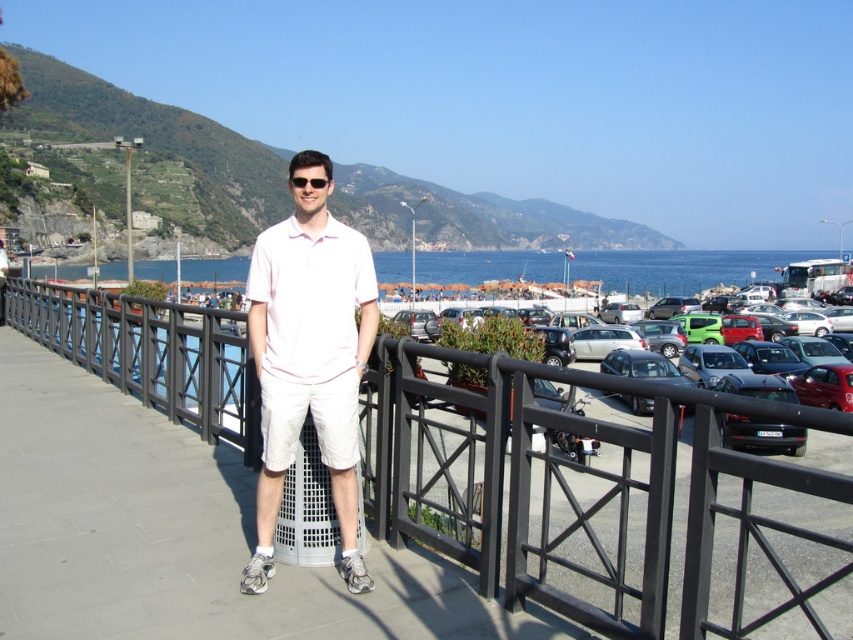
Question: Is black metal fence at center wider than shiny black car at center?

Choices:
 (A) yes
 (B) no

Answer: (A)

Question: Is black metal fence at center bigger than pink cotton polo shirt at center?

Choices:
 (A) yes
 (B) no

Answer: (A)

Question: Considering the real-world distances, which object is closest to the white cotton shirt at center?

Choices:
 (A) blue water at center
 (B) pink cotton polo shirt at center

Answer: (B)

Question: Which of the following is the farthest from the observer?

Choices:
 (A) pink cotton polo shirt at center
 (B) black metal fence at center

Answer: (A)

Question: From the image, what is the correct spatial relationship of white cotton shirt at center in relation to blue water at center?

Choices:
 (A) right
 (B) left

Answer: (B)

Question: Estimate the real-world distances between objects in this image. Which object is farther from the black metal fence at center?

Choices:
 (A) pink cotton polo shirt at center
 (B) white cotton shirt at center
 (C) blue water at center

Answer: (C)